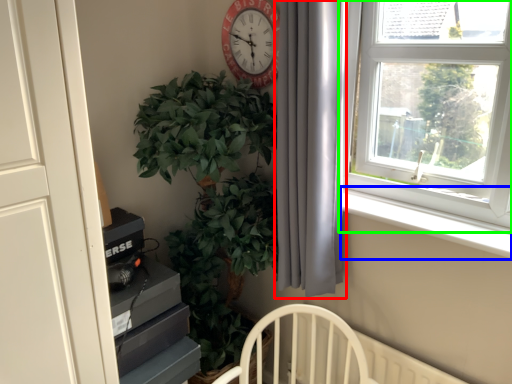
Question: Based on their relative distances, which object is farther from curtain (highlighted by a red box)? Choose from window sill (highlighted by a blue box) and window (highlighted by a green box).

Choices:
 (A) window sill
 (B) window

Answer: (A)